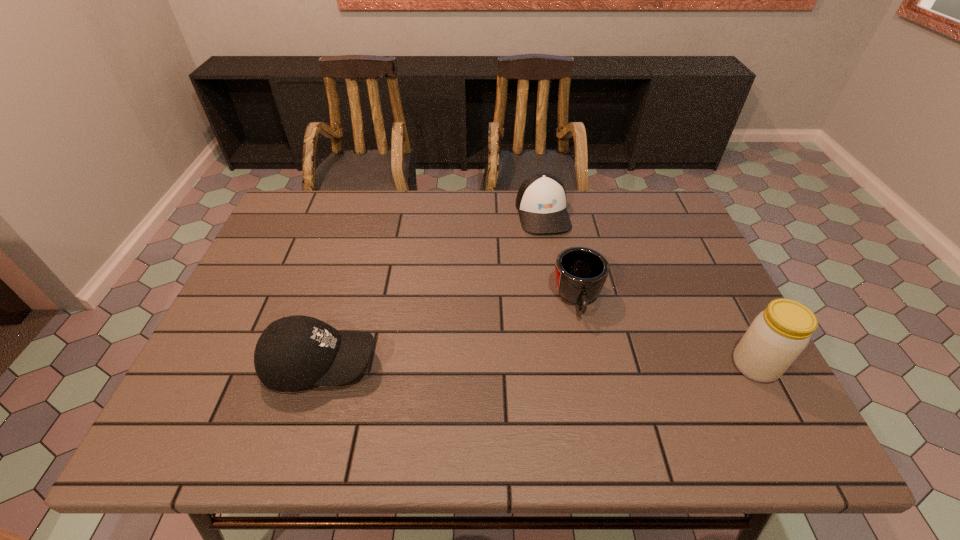
The width and height of the screenshot is (960, 540). What are the coordinates of `vacant space at the far edge of the desktop` in the screenshot? It's located at (502, 233).

Identify the location of free point at the near edge. (622, 392).

In the image, there is a desktop. At what (x,y) coordinates should I click in order to perform the action: click on vacant space at the left edge. Please return your answer as a coordinate pair (x, y). This screenshot has height=540, width=960. Looking at the image, I should click on (276, 249).

The width and height of the screenshot is (960, 540). What are the coordinates of `vacant space at the right edge of the desktop` in the screenshot? It's located at (694, 325).

Identify the location of vacant space at the far left corner of the desktop. (320, 208).

Locate an element on the screen. The width and height of the screenshot is (960, 540). vacant space at the far right corner of the desktop is located at coordinates (647, 225).

You are a GUI agent. You are given a task and a screenshot of the screen. Output one action in this format:
    pyautogui.click(x=<x>, y=<y>)
    Task: Click on the free space at the near right corner of the desktop
    The height and width of the screenshot is (540, 960).
    Given the screenshot: What is the action you would take?
    pyautogui.click(x=715, y=402)

Locate an element on the screen. This screenshot has height=540, width=960. free space between the baseball cap and the third nearest object is located at coordinates (449, 332).

The width and height of the screenshot is (960, 540). I want to click on free space between the leftmost object and the jar, so click(538, 364).

The width and height of the screenshot is (960, 540). I want to click on vacant area that lies between the rightmost object and the leftmost object, so click(x=538, y=364).